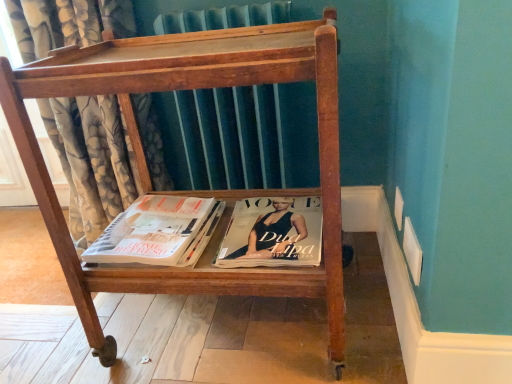
Identify the location of matte black magazine at center. The height and width of the screenshot is (384, 512). (274, 234).

What do you see at coordinates (92, 160) in the screenshot? This screenshot has width=512, height=384. I see `floral fabric curtain at left` at bounding box center [92, 160].

This screenshot has height=384, width=512. Describe the element at coordinates (158, 232) in the screenshot. I see `matte white book at center` at that location.

The height and width of the screenshot is (384, 512). Identify the location of matte black magazine at center. (274, 234).

Would you say wooden magazine rack at center contains floral fabric curtain at left?

Actually, floral fabric curtain at left is outside wooden magazine rack at center.

How different are the orientations of wooden magazine rack at center and floral fabric curtain at left in degrees?

0.652 degrees separate the facing orientations of wooden magazine rack at center and floral fabric curtain at left.

Considering the positions of point (321, 294) and point (123, 130), is point (321, 294) closer or farther from the camera than point (123, 130)?

Point (321, 294) is positioned closer to the camera compared to point (123, 130).

Is wooden magazine rack at center behind floral fabric curtain at left?

No, it is in front of floral fabric curtain at left.

Is matte black magazine at center not within matte white book at center?

matte black magazine at center is positioned outside matte white book at center.

Does point (225, 259) appear closer or farther from the camera than point (176, 223)?

Point (225, 259) is closer to the camera than point (176, 223).

From their relative heights in the image, would you say matte black magazine at center is taller or shorter than matte white book at center?

Clearly, matte black magazine at center is taller compared to matte white book at center.

Does matte black magazine at center appear on the left side of matte white book at center?

Incorrect, matte black magazine at center is not on the left side of matte white book at center.

Between matte black magazine at center and wooden magazine rack at center, which one is positioned in front?

wooden magazine rack at center is closer to the camera.

Consider the image. From the image's perspective, between matte black magazine at center and wooden magazine rack at center, who is located below?

From the image's view, matte black magazine at center is below.

From a real-world perspective, is matte black magazine at center positioned above or below wooden magazine rack at center?

matte black magazine at center is below wooden magazine rack at center.

Is matte white book at center facing towards matte black magazine at center?

No, matte white book at center is not aimed at matte black magazine at center.

Considering the relative positions of matte white book at center and matte black magazine at center in the image provided, is matte white book at center to the left or to the right of matte black magazine at center?

Clearly, matte white book at center is on the left of matte black magazine at center in the image.

From a real-world perspective, which is physically below, matte white book at center or matte black magazine at center?

matte black magazine at center, from a real-world perspective.

From the image's perspective, which is above, matte white book at center or matte black magazine at center?

matte white book at center is shown above in the image.

Which of these two, floral fabric curtain at left or matte white book at center, is wider?

floral fabric curtain at left.

Considering the positions of point (122, 120) and point (143, 228), is point (122, 120) closer or farther from the camera than point (143, 228)?

Clearly, point (122, 120) is more distant from the camera than point (143, 228).

At what (x,y) coordinates should I click in order to perform the action: click on book directly beneath the floral fabric curtain at left (from a real-world perspective). Please return your answer as a coordinate pair (x, y). Looking at the image, I should click on (158, 232).

Based on the photo, from the image's perspective, would you say floral fabric curtain at left is shown under matte white book at center?

No, from the image's perspective, floral fabric curtain at left is not below matte white book at center.

Find the location of a particular element. This screenshot has height=384, width=512. book that appears on the left of wooden magazine rack at center is located at coordinates (158, 232).

Are wooden magazine rack at center and matte white book at center making contact?

They are not placed beside each other.

Looking at their sizes, would you say wooden magazine rack at center is wider or thinner than matte white book at center?

Clearly, wooden magazine rack at center has more width compared to matte white book at center.

Which is more to the left, wooden magazine rack at center or matte white book at center?

From the viewer's perspective, matte white book at center appears more on the left side.

Measure the distance between floral fabric curtain at left and wooden magazine rack at center.

floral fabric curtain at left is 12.95 inches from wooden magazine rack at center.

Is floral fabric curtain at left looking in the opposite direction of wooden magazine rack at center?

That's not correct — floral fabric curtain at left is not looking away from wooden magazine rack at center.

How different are the orientations of floral fabric curtain at left and wooden magazine rack at center in degrees?

floral fabric curtain at left and wooden magazine rack at center are facing 0.652 degrees away from each other.

Considering the positions of objects floral fabric curtain at left and wooden magazine rack at center in the image provided, who is more to the left, floral fabric curtain at left or wooden magazine rack at center?

floral fabric curtain at left.

Where is `furniture that is on the right side of floral fabric curtain at left`? furniture that is on the right side of floral fabric curtain at left is located at coordinates (191, 191).

At what (x,y) coordinates should I click in order to perform the action: click on book behind the matte black magazine at center. Please return your answer as a coordinate pair (x, y). This screenshot has height=384, width=512. Looking at the image, I should click on (158, 232).

From the image, which object appears to be farther from wooden magazine rack at center, matte white book at center or floral fabric curtain at left?

The object further to wooden magazine rack at center is floral fabric curtain at left.

Looking at the image, which one is located closer to wooden magazine rack at center, matte black magazine at center or matte white book at center?

matte white book at center is closer to wooden magazine rack at center.

Which object lies further to the anchor point matte black magazine at center, matte white book at center or floral fabric curtain at left?

floral fabric curtain at left lies further to matte black magazine at center than the other object.

From the image, which object appears to be nearer to matte white book at center, wooden magazine rack at center or matte black magazine at center?

Among the two, matte black magazine at center is located nearer to matte white book at center.

Which object lies further to the anchor point matte white book at center, wooden magazine rack at center or floral fabric curtain at left?

floral fabric curtain at left lies further to matte white book at center than the other object.

Estimate the real-world distances between objects in this image. Which object is closer to matte black magazine at center, matte white book at center or wooden magazine rack at center?

matte white book at center is closer to matte black magazine at center.

From the picture: Looking at the image, which one is located further to matte black magazine at center, floral fabric curtain at left or matte white book at center?

Based on the image, floral fabric curtain at left appears to be further to matte black magazine at center.

From the image, which object appears to be farther from floral fabric curtain at left, matte white book at center or matte black magazine at center?

Based on the image, matte black magazine at center appears to be further to floral fabric curtain at left.

Where is `book between floral fabric curtain at left and matte black magazine at center from left to right`? book between floral fabric curtain at left and matte black magazine at center from left to right is located at coordinates (158, 232).

Locate an element on the screen. person between wooden magazine rack at center and matte white book at center in the front-back direction is located at coordinates (274, 234).

The height and width of the screenshot is (384, 512). What are the coordinates of `furniture situated between floral fabric curtain at left and matte black magazine at center from left to right` in the screenshot? It's located at (191, 191).

The image size is (512, 384). Identify the location of book situated between floral fabric curtain at left and wooden magazine rack at center from left to right. (158, 232).